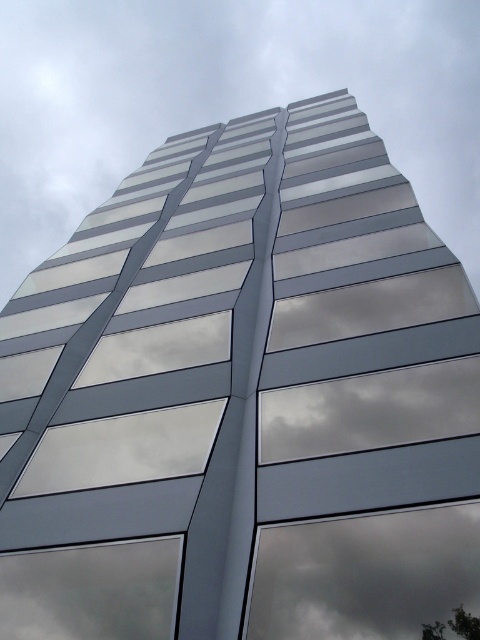
Based on the photo, you are standing in front of the building and want to take a photo that includes both the dark gray reflective cloud at center and the transparent glass window at lower left. Which object will appear larger in the photo?

The dark gray reflective cloud at center will appear larger in the photo because it is closer to the viewer than the transparent glass window at lower left.